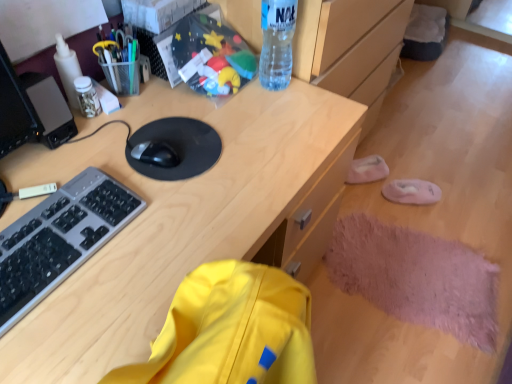
Identify the location of space that is in front of transparent plastic bottle at upper center, positioned as the first bottle in right-to-left order. (272, 114).